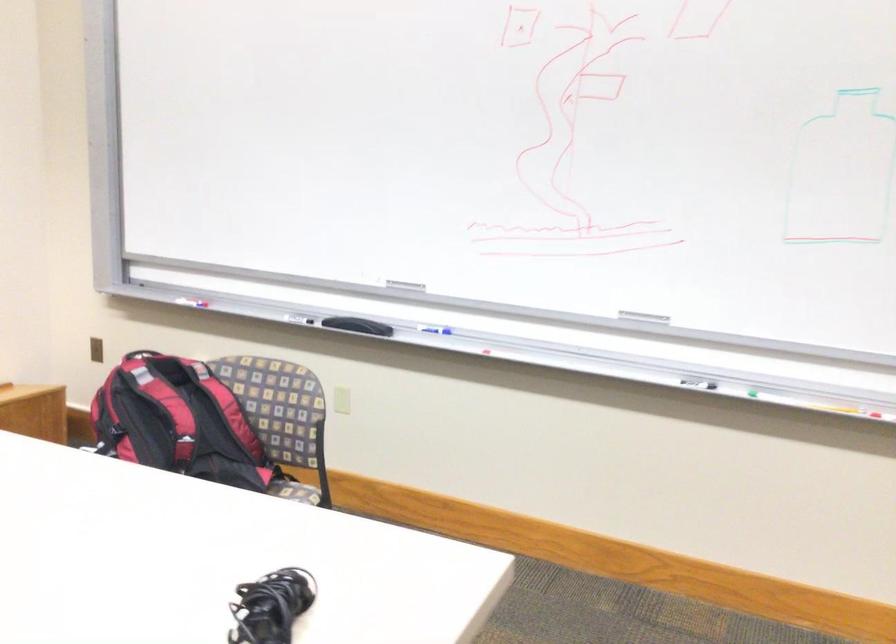
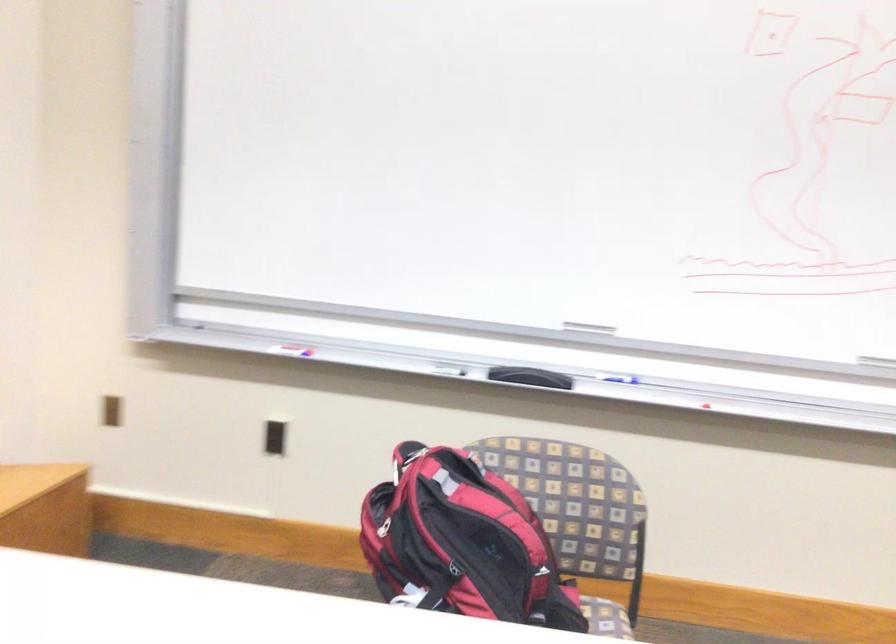
Where in the second image is the point corresponding to pixel 350 322 from the first image?

(530, 377)